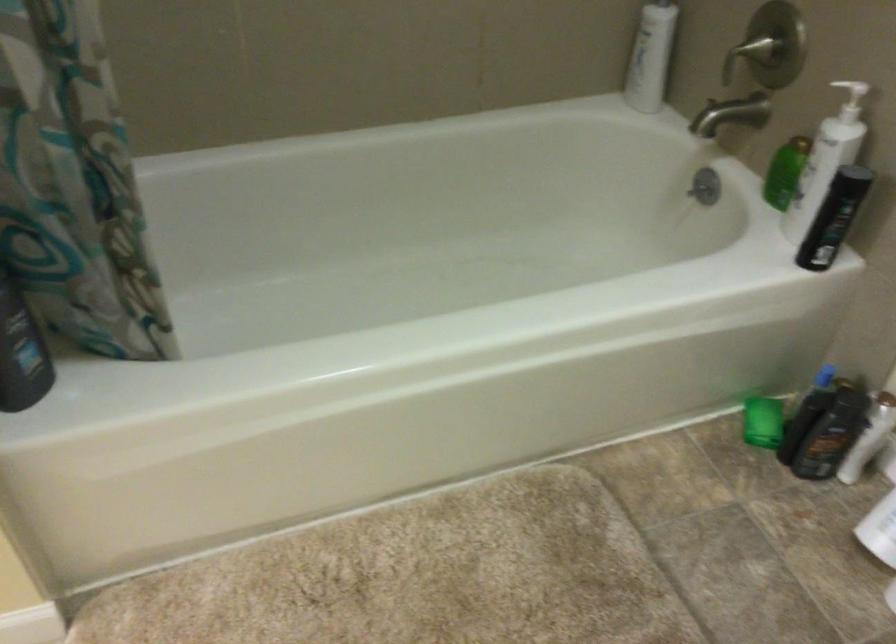
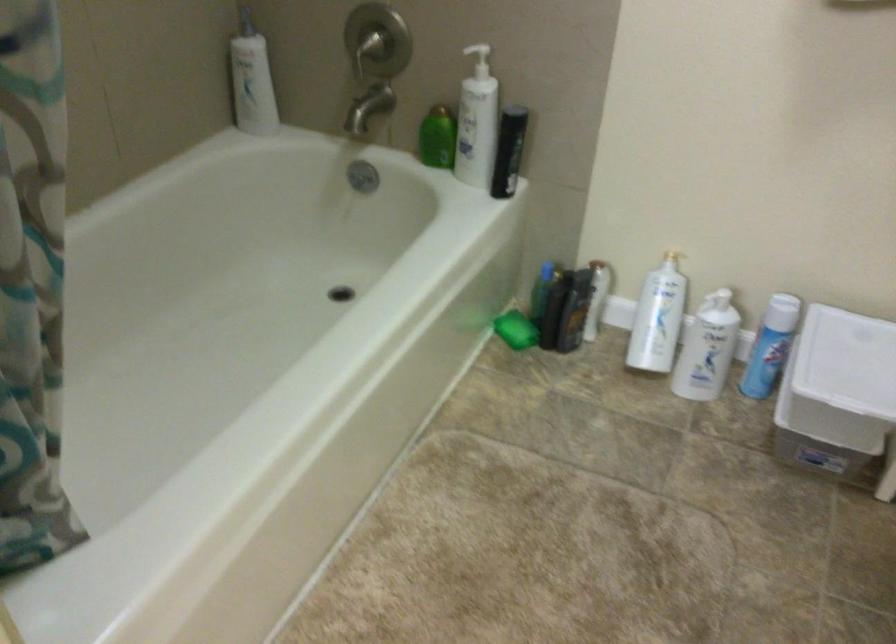
Where in the second image is the point corresponding to the point at 815,433 from the first image?

(574, 310)